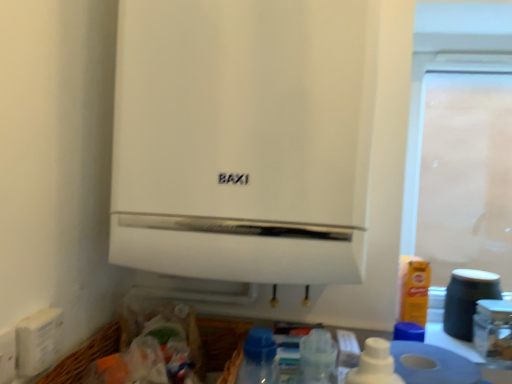
This screenshot has width=512, height=384. I want to click on transparent plastic screen door at upper right, so click(466, 175).

The height and width of the screenshot is (384, 512). What do you see at coordinates (431, 364) in the screenshot?
I see `white matte toilet paper at lower right` at bounding box center [431, 364].

What do you see at coordinates (7, 355) in the screenshot? The height and width of the screenshot is (384, 512). I see `white plastic electric outlet at lower left` at bounding box center [7, 355].

You are a GUI agent. You are given a task and a screenshot of the screen. Output one action in this format:
    pyautogui.click(x=<x>, y=<y>)
    Task: Click on the white matte boiler at center
    The height and width of the screenshot is (384, 512).
    Given the screenshot: What is the action you would take?
    pyautogui.click(x=265, y=149)

Is there a large distance between white matte toilet paper at lower right and matte black jar at lower right?

They are positioned close to each other.

Is white matte toilet paper at lower right inside the boundaries of matte black jar at lower right, or outside?

white matte toilet paper at lower right is not inside matte black jar at lower right, it's outside.

Is white matte toilet paper at lower right smaller than matte black jar at lower right?

No, white matte toilet paper at lower right is not smaller than matte black jar at lower right.

From the image's perspective, would you say white matte toilet paper at lower right is positioned over matte black jar at lower right?

Incorrect, from the image's perspective, white matte toilet paper at lower right is lower than matte black jar at lower right.

Considering the relative sizes of transparent plastic screen door at upper right and matte black jar at lower right in the image provided, is transparent plastic screen door at upper right shorter than matte black jar at lower right?

Incorrect, the height of transparent plastic screen door at upper right does not fall short of that of matte black jar at lower right.

In the scene shown: What's the angular difference between transparent plastic screen door at upper right and matte black jar at lower right's facing directions?

0.75 degrees.

Between transparent plastic screen door at upper right and matte black jar at lower right, which one has larger width?

With larger width is matte black jar at lower right.

Is transparent plastic screen door at upper right looking in the opposite direction of matte black jar at lower right?

Yes, transparent plastic screen door at upper right is positioned with its back facing matte black jar at lower right.

Considering the relative positions of white plastic electric outlet at lower left and transparent plastic screen door at upper right in the image provided, is white plastic electric outlet at lower left to the right of transparent plastic screen door at upper right from the viewer's perspective?

No.

From the image's perspective, does white plastic electric outlet at lower left appear higher than transparent plastic screen door at upper right?

No, from the image's perspective, white plastic electric outlet at lower left is not over transparent plastic screen door at upper right.

Which is in front, point (14, 341) or point (443, 107)?

The point (14, 341) is closer to the camera.

This screenshot has width=512, height=384. I want to click on appliance located below the transparent plastic screen door at upper right (from the image's perspective), so coord(467,299).

From the image's perspective, would you say matte black jar at lower right is shown under transparent plastic screen door at upper right?

Correct, matte black jar at lower right appears lower than transparent plastic screen door at upper right in the image.

Who is shorter, matte black jar at lower right or transparent plastic screen door at upper right?

With less height is matte black jar at lower right.

Can you confirm if matte black jar at lower right is smaller than transparent plastic screen door at upper right?

Correct, matte black jar at lower right occupies less space than transparent plastic screen door at upper right.

Considering the sizes of objects white matte boiler at center and matte black jar at lower right in the image provided, who is thinner, white matte boiler at center or matte black jar at lower right?

matte black jar at lower right.

Is white matte boiler at center aimed at matte black jar at lower right?

No, white matte boiler at center is not turned towards matte black jar at lower right.

In the scene shown: Considering the relative positions of white matte boiler at center and matte black jar at lower right in the image provided, is white matte boiler at center to the right of matte black jar at lower right from the viewer's perspective?

Incorrect, white matte boiler at center is not on the right side of matte black jar at lower right.

Which is closer to the camera, (330,233) or (449,294)?

Positioned in front is point (330,233).

Is matte black jar at lower right taller or shorter than white matte toilet paper at lower right?

Considering their sizes, matte black jar at lower right has more height than white matte toilet paper at lower right.

Who is bigger, matte black jar at lower right or white matte toilet paper at lower right?

white matte toilet paper at lower right is bigger.

From a real-world perspective, is matte black jar at lower right positioned under white matte toilet paper at lower right based on gravity?

No, from a real-world perspective, matte black jar at lower right is not below white matte toilet paper at lower right.

Are matte black jar at lower right and white matte toilet paper at lower right far apart?

That's not correct — matte black jar at lower right is a little close to white matte toilet paper at lower right.

Does white matte boiler at center have a lesser width compared to transparent plastic screen door at upper right?

No, white matte boiler at center is not thinner than transparent plastic screen door at upper right.

Which of these two, white matte boiler at center or transparent plastic screen door at upper right, stands taller?

Standing taller between the two is transparent plastic screen door at upper right.

Is transparent plastic screen door at upper right completely or partially inside white matte boiler at center?

Definitely not — transparent plastic screen door at upper right is not inside white matte boiler at center.

Where is `screen door on the right of white matte boiler at center`? The height and width of the screenshot is (384, 512). screen door on the right of white matte boiler at center is located at coordinates (466, 175).

Where is `toilet paper lying in front of the matte black jar at lower right`? toilet paper lying in front of the matte black jar at lower right is located at coordinates (431, 364).

Image resolution: width=512 pixels, height=384 pixels. I want to click on appliance beneath the transparent plastic screen door at upper right (from a real-world perspective), so [467, 299].

Based on their spatial positions, is white plastic electric outlet at lower left or transparent plastic screen door at upper right further from matte black jar at lower right?

Among the two, transparent plastic screen door at upper right is located further to matte black jar at lower right.

From the image, which object appears to be farther from white matte toilet paper at lower right, matte black jar at lower right or white matte boiler at center?

The object further to white matte toilet paper at lower right is white matte boiler at center.

Which object lies further to the anchor point white matte toilet paper at lower right, white matte boiler at center or transparent plastic screen door at upper right?

The object further to white matte toilet paper at lower right is transparent plastic screen door at upper right.

Looking at the image, which one is located closer to white matte boiler at center, matte black jar at lower right or transparent plastic screen door at upper right?

matte black jar at lower right is closer to white matte boiler at center.

When comparing their distances from white matte toilet paper at lower right, does white plastic electric outlet at lower left or white matte boiler at center seem further?

white plastic electric outlet at lower left is further to white matte toilet paper at lower right.

Based on their spatial positions, is transparent plastic screen door at upper right or white matte toilet paper at lower right further from white plastic electric outlet at lower left?

transparent plastic screen door at upper right lies further to white plastic electric outlet at lower left than the other object.

Based on their spatial positions, is white matte toilet paper at lower right or white plastic electric outlet at lower left further from white matte boiler at center?

Among the two, white plastic electric outlet at lower left is located further to white matte boiler at center.

Looking at the image, which one is located closer to matte black jar at lower right, transparent plastic screen door at upper right or white plastic electric outlet at lower left?

Among the two, white plastic electric outlet at lower left is located nearer to matte black jar at lower right.

The height and width of the screenshot is (384, 512). Find the location of `toilet paper between white plastic electric outlet at lower left and matte black jar at lower right from left to right`. toilet paper between white plastic electric outlet at lower left and matte black jar at lower right from left to right is located at coordinates (431, 364).

Locate an element on the screen. Image resolution: width=512 pixels, height=384 pixels. home appliance between white plastic electric outlet at lower left and matte black jar at lower right from left to right is located at coordinates (265, 149).

At what (x,y) coordinates should I click in order to perform the action: click on toilet paper between white matte boiler at center and matte black jar at lower right from left to right. Please return your answer as a coordinate pair (x, y). The image size is (512, 384). Looking at the image, I should click on (431, 364).

Identify the location of screen door located between white matte boiler at center and matte black jar at lower right in the left-right direction. (466, 175).